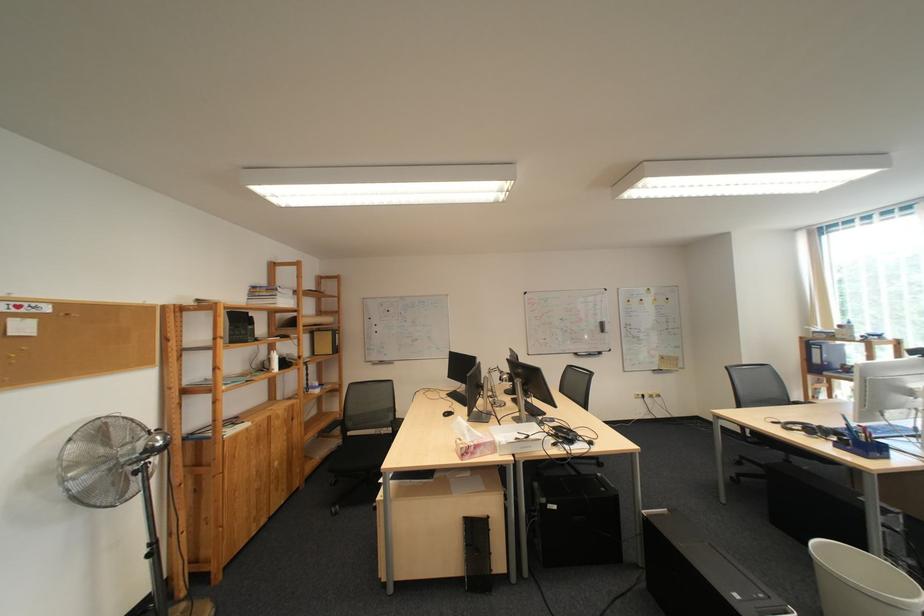
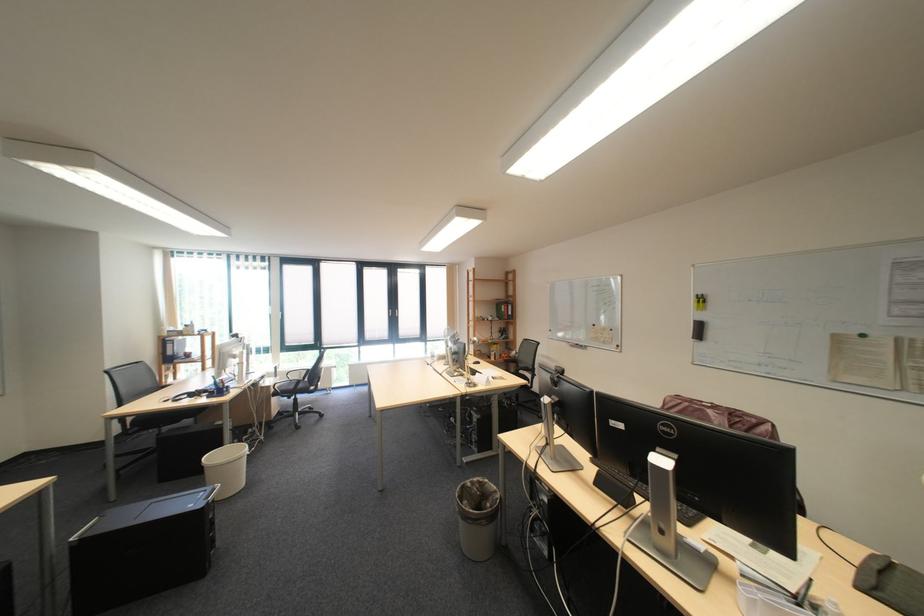
Question: The camera is either moving clockwise (left) or counter-clockwise (right) around the object. The first image is from the beginning of the video and the second image is from the end. Is the camera moving left or right when shooting the video?

Choices:
 (A) Left
 (B) Right

Answer: (A)